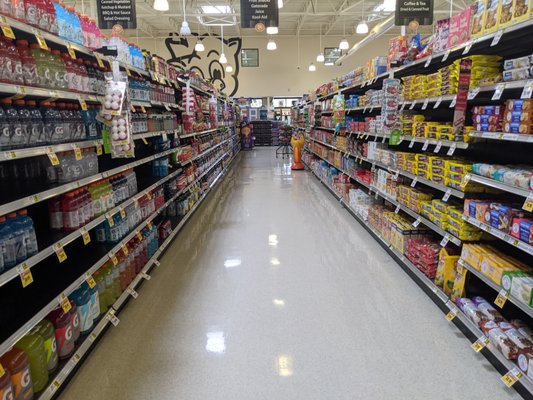
This screenshot has height=400, width=533. Find the location of `large drawing of "piggly wiggly" logo on beige wall`. large drawing of "piggly wiggly" logo on beige wall is located at coordinates (208, 52).